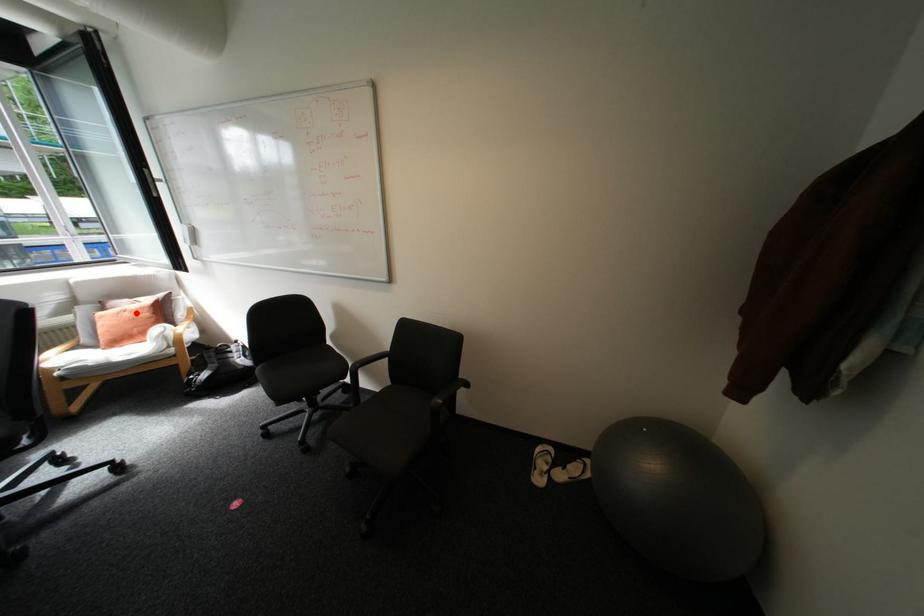
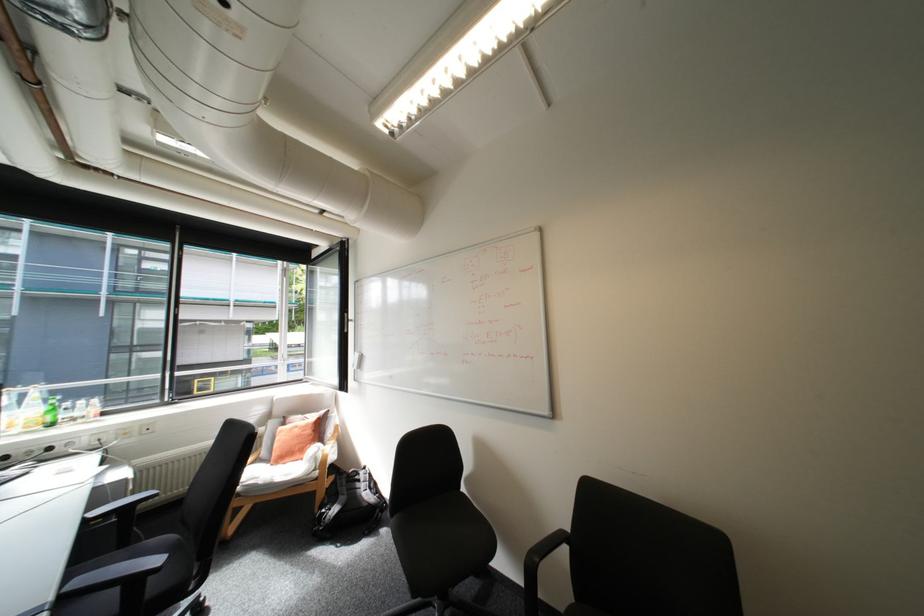
Locate, in the second image, the point that corresponds to the highlighted location in the first image.

(307, 429)